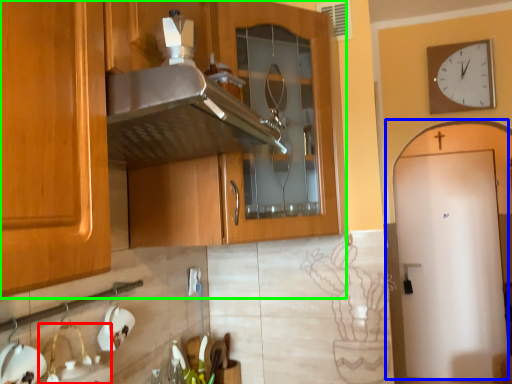
Question: Which object is positioned farthest from sink (highlighted by a red box)? Select from door (highlighted by a blue box) and cabinetry (highlighted by a green box).

Choices:
 (A) door
 (B) cabinetry

Answer: (A)